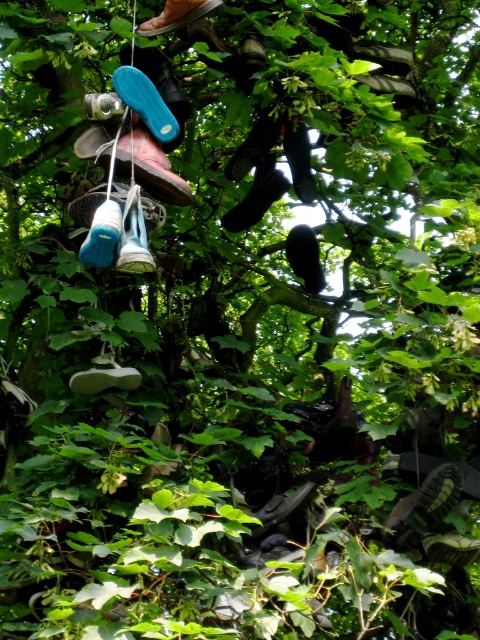
You are a delivery person trying to deliver a package to the house behind the tree. The path to the house is blocked by the shoes hanging from the tree. Which shoe, the blue suede shoe at center or the blue rubber shoe at upper center, should you move to create more space for the package to pass through?

The blue suede shoe at center is thinner than the blue rubber shoe at upper center, so moving the blue suede shoe at center would create more space for the package to pass through.

You are an artist planning to paint the tree with shoes. You need to know which shoe is wider. Which one is wider between the blue suede shoe at upper left and the blue rubber shoe at upper center?

The blue suede shoe at upper left is wider than the blue rubber shoe at upper center.

You are a painter standing 10 feet away from a tree with shoes hanging from its branches. You want to paint the blue suede shoe at center. Can you reach it with your 10 feet long pole to attach the paintbrush?

The blue suede shoe at center is 10.16 feet away from the camera. Since your pole is 10 feet long, you are 0.16 feet short, so you cannot reach it.